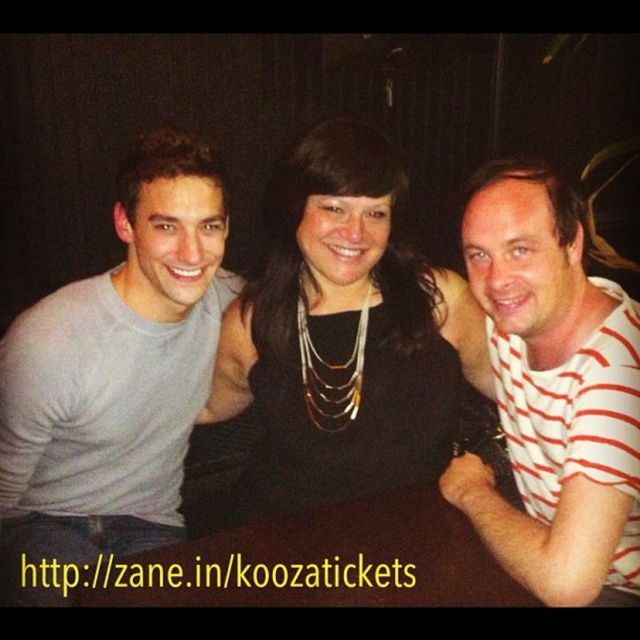
You are taking a photo of three people standing in a dimly lit room. You notice two points marked on the image at coordinates point (212,218) and point (424,353). If you want to focus your camera on the person closest to you, which point should you adjust the focus to?

Point (212,218) is closer to the camera than point (424,353), so you should focus on point (212,218) to capture the person nearest to you.

You are a photographer trying to capture a clear shot of the black fabric dress at center and the brown wooden table at center. Since the camera can only focus on one object at a time, which object should you choose to ensure it fills the frame more effectively?

The black fabric dress at center is bigger than the brown wooden table at center, so you should focus on the black fabric dress at center to ensure it fills the frame more effectively.

You are a photographer trying to capture a clear shot of the black fabric dress at center and the brown wooden table at center. Based on their positions, which object is more likely to be in focus if you focus on the center of the image?

The black fabric dress at center is more likely to be in focus because it is positioned closer to the camera than the brown wooden table at center.